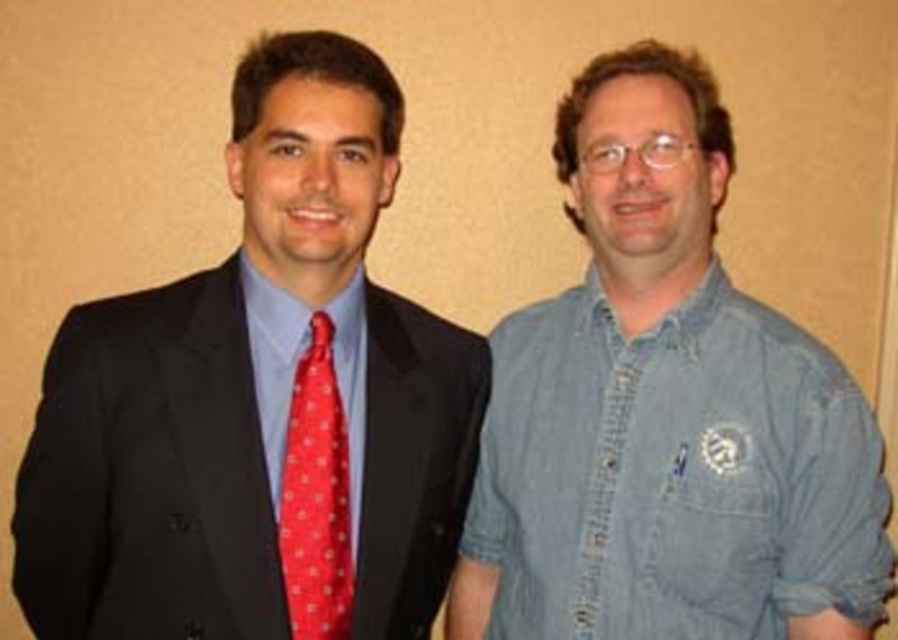
You are standing in front of two men against a wall. You need to determine which point is closer to you. The points are labeled as point (307, 120) and point (623, 442). Which point is closer to you?

Point (307, 120) is in front of point (623, 442), so it is closer to you.

You are a photographer setting up for a group photo. You need to arrange the two men so that the denim shirt at right is to the left of the red dotted fabric tie at left. Is this arrangement possible based on their current positions?

The denim shirt at right is currently positioned on the right side of the red dotted fabric tie at left. To place the denim shirt at right to the left of the red dotted fabric tie at left, they would need to swap positions. Since their current arrangement has the denim shirt at right on the right, moving them would make it possible.